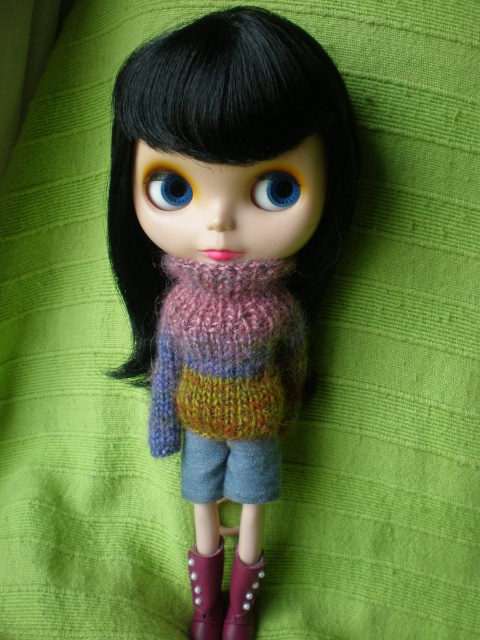
Does knitted wool sweater at center appear under blue glossy eye at upper center?

Correct, knitted wool sweater at center is located below blue glossy eye at upper center.

Which is in front, point (178, 260) or point (146, 177)?

Point (146, 177)

You are a GUI agent. You are given a task and a screenshot of the screen. Output one action in this format:
    pyautogui.click(x=<x>, y=<y>)
    Task: Click on the knitted wool sweater at center
    The image size is (480, 640).
    Given the screenshot: What is the action you would take?
    pyautogui.click(x=226, y=353)

Is knitted wool sweater at center thinner than purple suede boot at lower center?

A: In fact, knitted wool sweater at center might be wider than purple suede boot at lower center.

Does knitted wool sweater at center appear over purple suede boot at lower center?

Yes.

What do you see at coordinates (226, 353) in the screenshot?
I see `knitted wool sweater at center` at bounding box center [226, 353].

The image size is (480, 640). In order to click on knitted wool sweater at center in this screenshot , I will do `click(226, 353)`.

Who is positioned more to the left, blue matte eye at center or blue glossy eye at upper center?

blue glossy eye at upper center

Who is taller, blue matte eye at center or blue glossy eye at upper center?

blue glossy eye at upper center is taller.

Describe the element at coordinates (276, 189) in the screenshot. I see `blue matte eye at center` at that location.

Where is `blue matte eye at center`? blue matte eye at center is located at coordinates (276, 189).